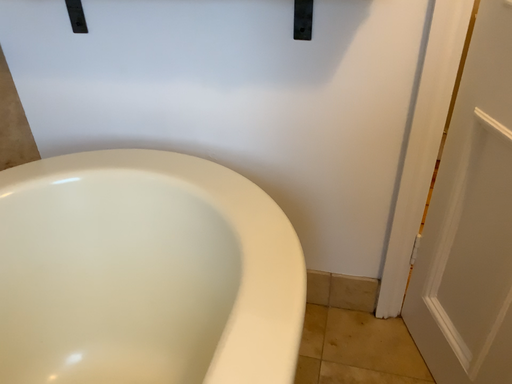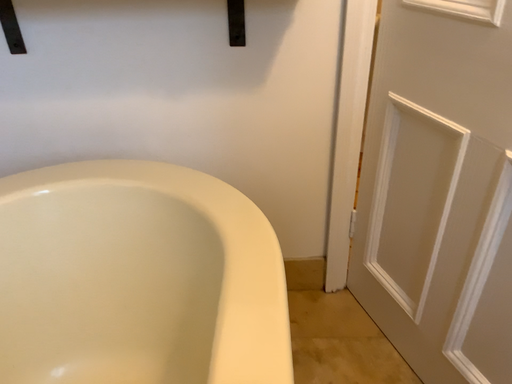
Question: How did the camera likely rotate when shooting the video?

Choices:
 (A) rotated left
 (B) rotated right

Answer: (B)